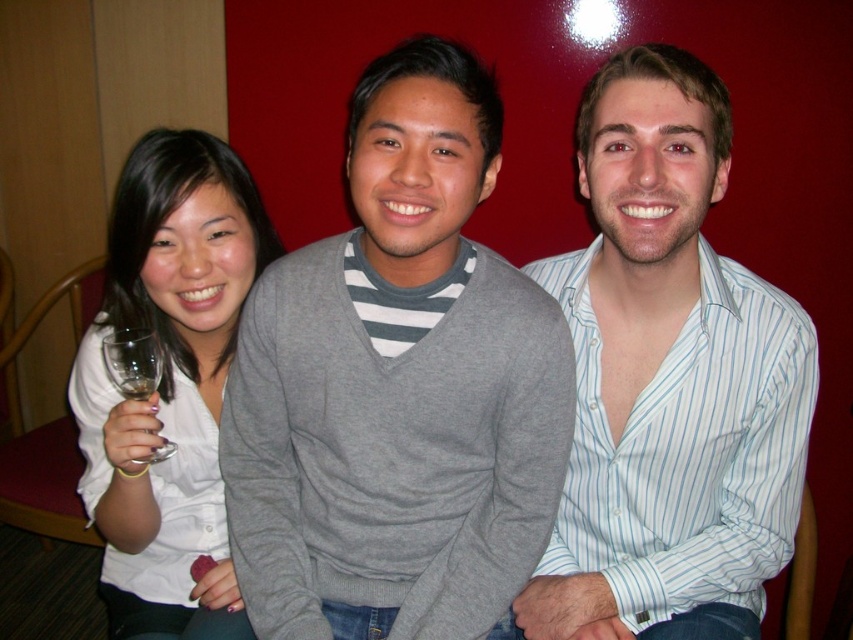
You are a photographer trying to capture a group photo of the gray sweater at center and the white striped shirt at center. Since you want to ensure both are in focus, you need to know their relative positions. Which one is positioned to the left?

The gray sweater at center is to the left of the white striped shirt at center, so the gray sweater at center is positioned to the left.

You are a photographer trying to capture a clear shot of the gray sweater at center and the white striped shirt at center. Which one is closer to the camera?

The gray sweater at center is in front of the white striped shirt at center, so the gray sweater at center is closer to the camera.

You are a photographer standing at the camera position. You want to ensure that the white matte shirt at left is in focus while the other subjects are slightly blurred. Given that your camera has a depth of field setting, what adjustment should you make?

To keep the white matte shirt at left in focus while blurring the others, adjust the camera to a shallow depth of field, ensuring the focus remains on the white matte shirt at left.